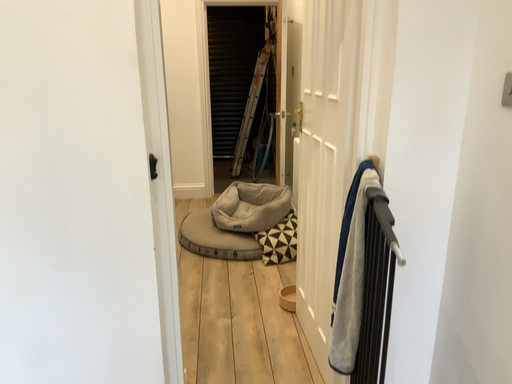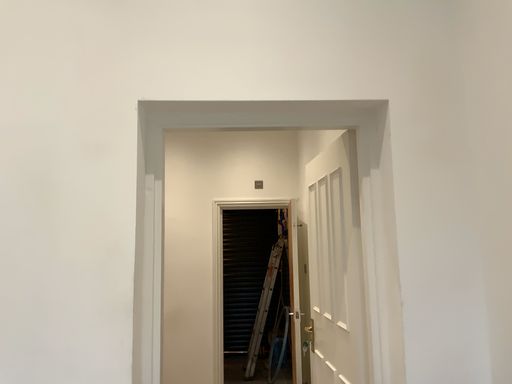
Question: How did the camera likely rotate when shooting the video?

Choices:
 (A) rotated upward
 (B) rotated downward

Answer: (A)